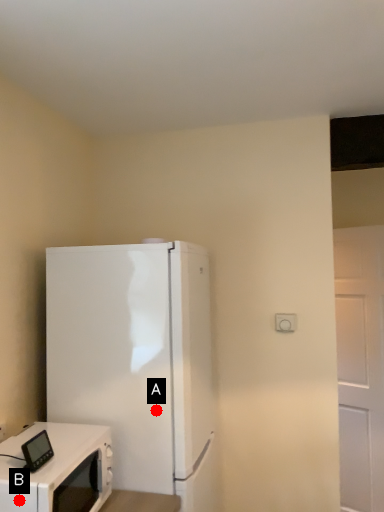
Question: Two points are circled on the image, labeled by A and B beside each circle. Among these points, which one is nearest to the camera?

Choices:
 (A) A is closer
 (B) B is closer

Answer: (B)